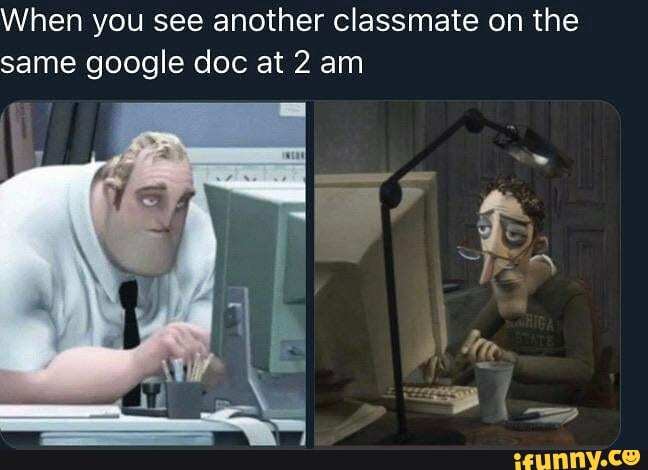
Where is `pencil cup holder`? The image size is (648, 470). pencil cup holder is located at coordinates (181, 403).